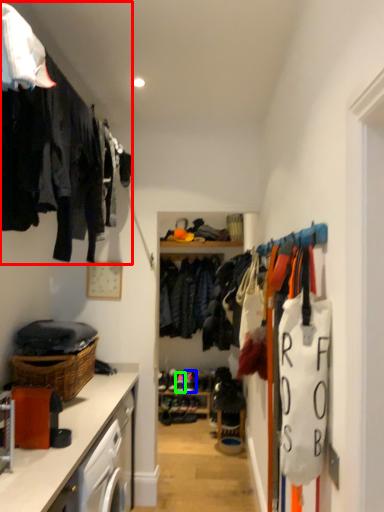
Question: Which object is the closest to the closet (highlighted by a red box)? Choose among these: shoe (highlighted by a blue box) or shoe (highlighted by a green box).

Choices:
 (A) shoe
 (B) shoe

Answer: (A)